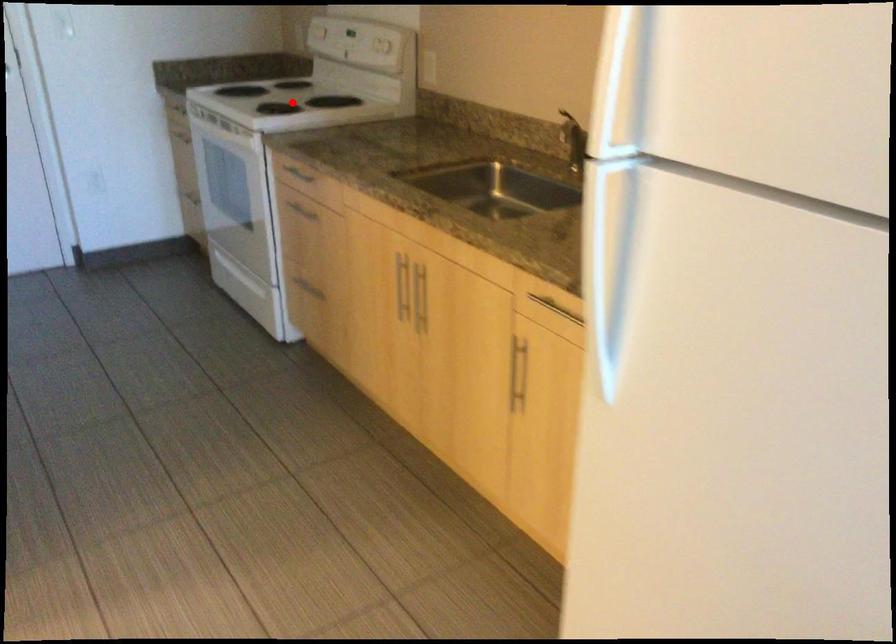
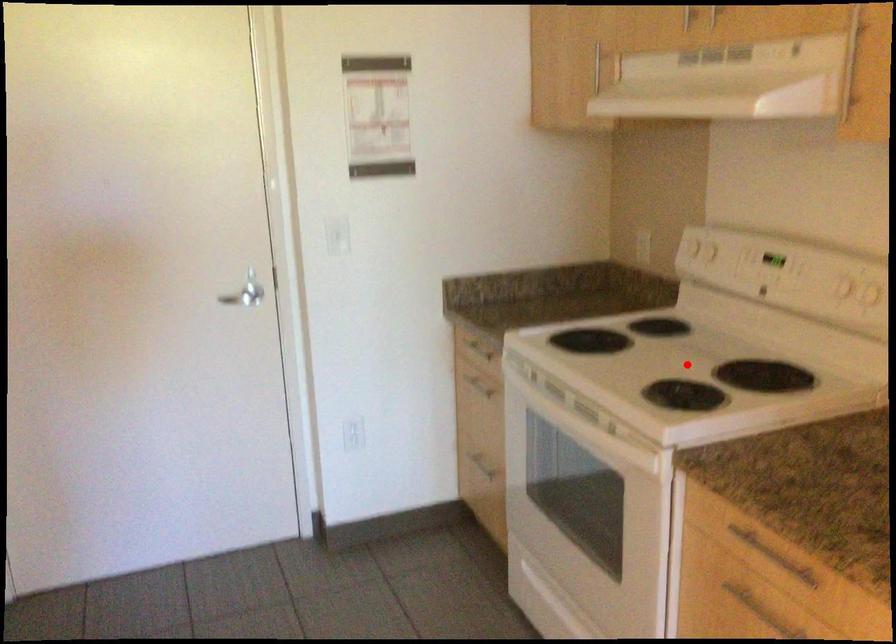
In the scene shown: I am providing you with two images of the same scene from different viewpoints. A red point is marked on the first image and another point is marked on the second image. Are the points marked in image1 and image2 representing the same 3D position?

Yes